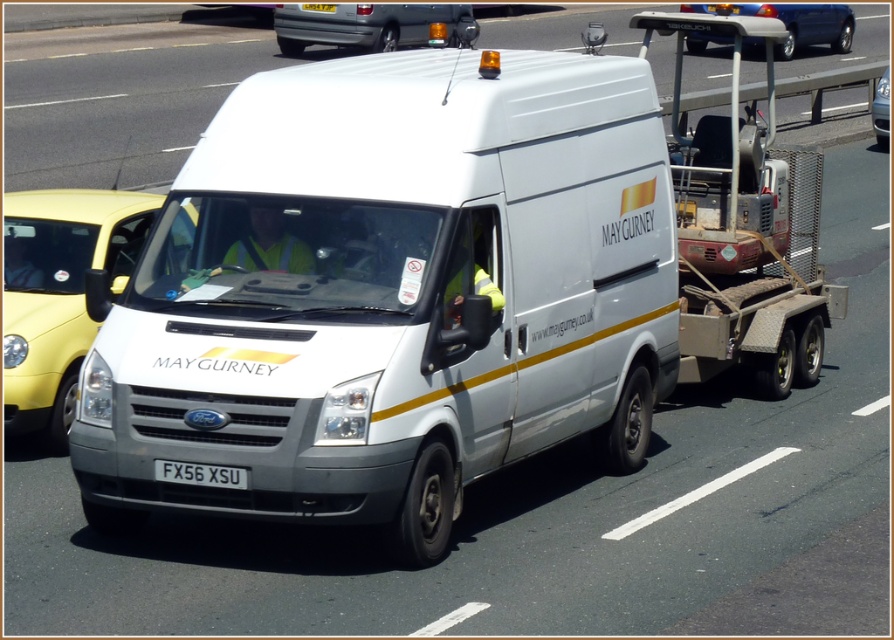
Question: Considering the real-world distances, which object is farthest from the metallic silver car at center?

Choices:
 (A) metallic gray trailer at right
 (B) silver metallic van at center
 (C) metallic blue car at upper center

Answer: (B)

Question: Does white glossy taxi at left appear over metallic blue car at upper center?

Choices:
 (A) yes
 (B) no

Answer: (B)

Question: Does white glossy taxi at left come behind white plastic license plate at center?

Choices:
 (A) no
 (B) yes

Answer: (B)

Question: Which point is closer to the camera?

Choices:
 (A) white plastic license plate at center
 (B) silver metallic van at center
 (C) white matte van at center
 (D) metallic blue car at upper center

Answer: (C)

Question: Which point appears farthest from the camera in this image?

Choices:
 (A) (125, 470)
 (B) (874, 131)
 (C) (682, 141)
 (D) (221, 465)

Answer: (B)

Question: Does metallic gray trailer at right have a greater width compared to silver metallic van at center?

Choices:
 (A) no
 (B) yes

Answer: (B)